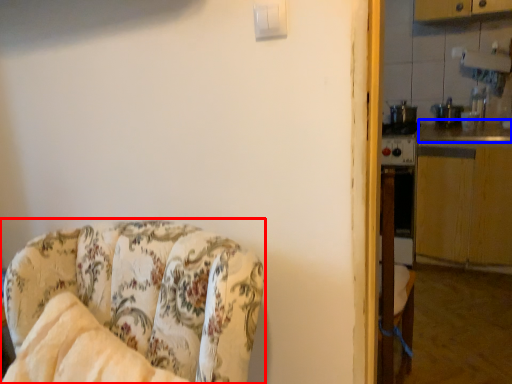
Question: Which object appears farthest to the camera in this image, chair (highlighted by a red box) or counter top (highlighted by a blue box)?

Choices:
 (A) chair
 (B) counter top

Answer: (B)